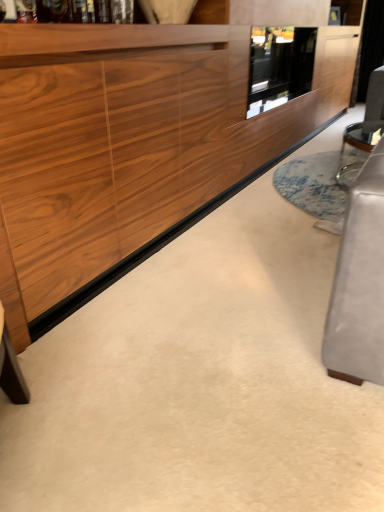
Question: Visually, is wooden cabinet at center positioned to the left or to the right of transparent glass door at upper center?

Choices:
 (A) left
 (B) right

Answer: (A)

Question: In terms of width, does wooden cabinet at center look wider or thinner when compared to transparent glass door at upper center?

Choices:
 (A) thin
 (B) wide

Answer: (B)

Question: In the image, is wooden cabinet at center positioned in front of or behind transparent glass door at upper center?

Choices:
 (A) front
 (B) behind

Answer: (A)

Question: From the image's perspective, is transparent glass door at upper center above or below wooden cabinet at center?

Choices:
 (A) below
 (B) above

Answer: (B)

Question: Considering the positions of transparent glass door at upper center and wooden cabinet at center in the image, is transparent glass door at upper center taller or shorter than wooden cabinet at center?

Choices:
 (A) short
 (B) tall

Answer: (A)

Question: Is transparent glass door at upper center bigger or smaller than wooden cabinet at center?

Choices:
 (A) big
 (B) small

Answer: (B)

Question: Is point (291, 84) closer or farther from the camera than point (102, 89)?

Choices:
 (A) farther
 (B) closer

Answer: (A)